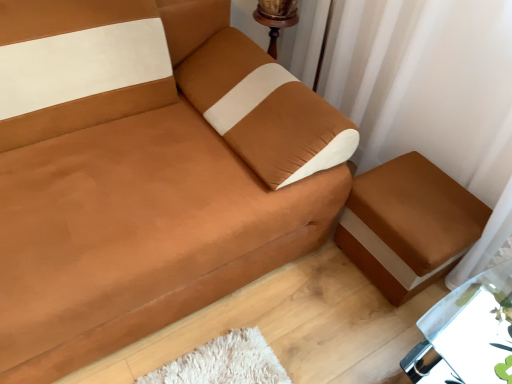
The width and height of the screenshot is (512, 384). What do you see at coordinates (426, 84) in the screenshot? I see `white sheer curtain at upper right` at bounding box center [426, 84].

What do you see at coordinates (408, 225) in the screenshot?
I see `brown fabric ottoman at lower right` at bounding box center [408, 225].

What do you see at coordinates (146, 173) in the screenshot?
I see `suede-like brown couch at center` at bounding box center [146, 173].

Looking at this image, measure the distance between point (267, 261) and camera.

A distance of 1.44 meters exists between point (267, 261) and camera.

Locate an element on the screen. metallic silver table at lower right is located at coordinates (467, 333).

Is point (276, 249) behind point (458, 325)?

No, (276, 249) is closer to viewer.

Which object is further away from the camera taking this photo, suede-like brown couch at center or metallic silver table at lower right?

metallic silver table at lower right is further from the camera.

Does suede-like brown couch at center have a smaller size compared to metallic silver table at lower right?

No.

Between suede-like brown couch at center and metallic silver table at lower right, which one appears on the right side from the viewer's perspective?

From the viewer's perspective, metallic silver table at lower right appears more on the right side.

Does metallic silver table at lower right have a lesser width compared to suede-like brown couch at center?

Yes.

Is suede-like brown couch at center completely or partially inside metallic silver table at lower right?

Actually, suede-like brown couch at center is outside metallic silver table at lower right.

From the picture: From a real-world perspective, relative to suede-like brown couch at center, is metallic silver table at lower right vertically above or below?

Clearly, from a real-world perspective, metallic silver table at lower right is below suede-like brown couch at center.

I want to click on furniture that appears on the left of metallic silver table at lower right, so pos(408,225).

Considering the positions of point (465, 353) and point (392, 272), is point (465, 353) closer or farther from the camera than point (392, 272)?

Point (465, 353) is positioned closer to the camera compared to point (392, 272).

Is metallic silver table at lower right facing away from brown fabric ottoman at lower right?

No, metallic silver table at lower right is not facing the opposite direction of brown fabric ottoman at lower right.

Considering the sizes of metallic silver table at lower right and brown fabric ottoman at lower right in the image, is metallic silver table at lower right taller or shorter than brown fabric ottoman at lower right?

In the image, metallic silver table at lower right appears to be taller than brown fabric ottoman at lower right.

Is white sheer curtain at upper right shorter than metallic silver table at lower right?

No.

From the image's perspective, who appears lower, white sheer curtain at upper right or metallic silver table at lower right?

From the image's view, metallic silver table at lower right is below.

From a real-world perspective, is white sheer curtain at upper right physically located above or below metallic silver table at lower right?

white sheer curtain at upper right is situated higher than metallic silver table at lower right in the real world.

This screenshot has height=384, width=512. Find the location of `table behind the white sheer curtain at upper right`. table behind the white sheer curtain at upper right is located at coordinates click(x=467, y=333).

From the image's perspective, is white sheer curtain at upper right located above or below suede-like brown couch at center?

Clearly, from the image's perspective, white sheer curtain at upper right is above suede-like brown couch at center.

Is white sheer curtain at upper right not close to suede-like brown couch at center?

No, white sheer curtain at upper right is not far away from suede-like brown couch at center.

This screenshot has width=512, height=384. Identify the location of studio couch beneath the white sheer curtain at upper right (from a real-world perspective). (146, 173).

Is brown fabric ottoman at lower right at the left side of white sheer curtain at upper right?

Incorrect, brown fabric ottoman at lower right is not on the left side of white sheer curtain at upper right.

Is brown fabric ottoman at lower right further to camera compared to white sheer curtain at upper right?

Yes.

Is brown fabric ottoman at lower right thinner than white sheer curtain at upper right?

Incorrect, the width of brown fabric ottoman at lower right is not less than that of white sheer curtain at upper right.

Is brown fabric ottoman at lower right taller or shorter than metallic silver table at lower right?

Clearly, brown fabric ottoman at lower right is shorter compared to metallic silver table at lower right.

Between brown fabric ottoman at lower right and metallic silver table at lower right, which one has smaller width?

Thinner between the two is brown fabric ottoman at lower right.

Is point (384, 197) farther from camera compared to point (458, 339)?

Yes, point (384, 197) is behind point (458, 339).

At what (x,y) coordinates should I click in order to perform the action: click on table on the right of brown fabric ottoman at lower right. Please return your answer as a coordinate pair (x, y). This screenshot has width=512, height=384. Looking at the image, I should click on (467, 333).

Where is `table behind the suede-like brown couch at center`? This screenshot has height=384, width=512. table behind the suede-like brown couch at center is located at coordinates (467, 333).

Locate an element on the screen. This screenshot has width=512, height=384. studio couch located above the metallic silver table at lower right (from a real-world perspective) is located at coordinates (146, 173).

Which object lies further to the anchor point suede-like brown couch at center, brown fabric ottoman at lower right or white sheer curtain at upper right?

Among the two, white sheer curtain at upper right is located further to suede-like brown couch at center.

Based on their spatial positions, is metallic silver table at lower right or suede-like brown couch at center closer to brown fabric ottoman at lower right?

The object closer to brown fabric ottoman at lower right is metallic silver table at lower right.

Based on the photo, estimate the real-world distances between objects in this image. Which object is closer to white sheer curtain at upper right, brown fabric ottoman at lower right or metallic silver table at lower right?

Among the two, brown fabric ottoman at lower right is located nearer to white sheer curtain at upper right.

When comparing their distances from brown fabric ottoman at lower right, does white sheer curtain at upper right or metallic silver table at lower right seem further?

metallic silver table at lower right.

Which object lies nearer to the anchor point brown fabric ottoman at lower right, white sheer curtain at upper right or suede-like brown couch at center?

Based on the image, white sheer curtain at upper right appears to be nearer to brown fabric ottoman at lower right.

Looking at the image, which one is located further to suede-like brown couch at center, brown fabric ottoman at lower right or metallic silver table at lower right?

metallic silver table at lower right lies further to suede-like brown couch at center than the other object.

Which object lies nearer to the anchor point metallic silver table at lower right, white sheer curtain at upper right or brown fabric ottoman at lower right?

brown fabric ottoman at lower right lies closer to metallic silver table at lower right than the other object.

When comparing their distances from suede-like brown couch at center, does white sheer curtain at upper right or metallic silver table at lower right seem closer?

The object closer to suede-like brown couch at center is white sheer curtain at upper right.

I want to click on curtain between suede-like brown couch at center and brown fabric ottoman at lower right from left to right, so click(x=426, y=84).

Identify the location of furniture between white sheer curtain at upper right and metallic silver table at lower right from top to bottom. (408, 225).

This screenshot has width=512, height=384. I want to click on curtain situated between suede-like brown couch at center and metallic silver table at lower right from left to right, so click(x=426, y=84).

Where is `furniture located between suede-like brown couch at center and metallic silver table at lower right in the left-right direction`? This screenshot has width=512, height=384. furniture located between suede-like brown couch at center and metallic silver table at lower right in the left-right direction is located at coordinates (408, 225).